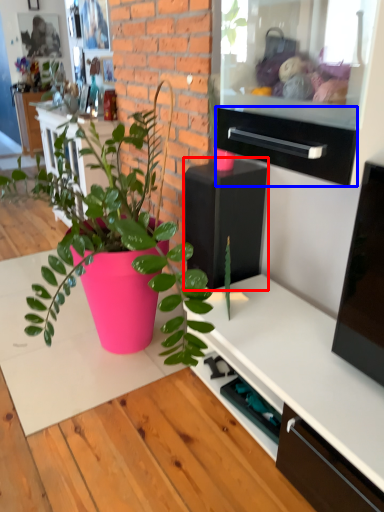
Question: Among these objects, which one is farthest to the camera, appliance (highlighted by a red box) or drawer (highlighted by a blue box)?

Choices:
 (A) appliance
 (B) drawer

Answer: (A)